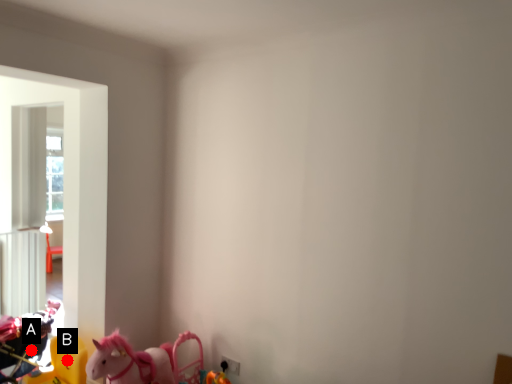
Question: Two points are circled on the image, labeled by A and B beside each circle. Among these points, which one is nearest to the camera?

Choices:
 (A) A is closer
 (B) B is closer

Answer: (B)